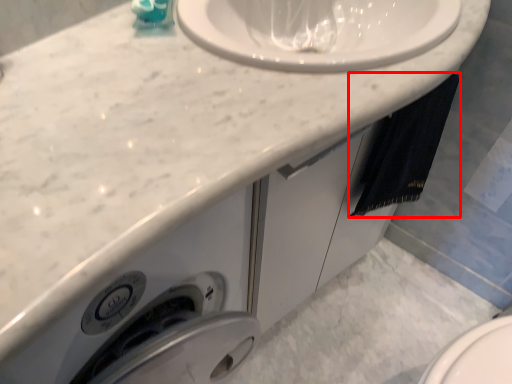
Question: From the image, what is the correct spatial relationship of bath towel (annotated by the red box) in relation to soap dispenser?

Choices:
 (A) right
 (B) left

Answer: (A)